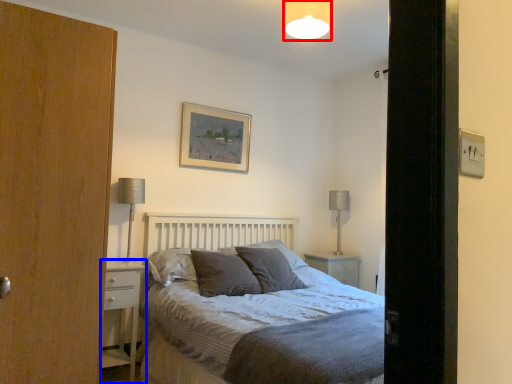
Question: Which object appears farthest to the camera in this image, light fixture (highlighted by a red box) or nightstand (highlighted by a blue box)?

Choices:
 (A) light fixture
 (B) nightstand

Answer: (B)